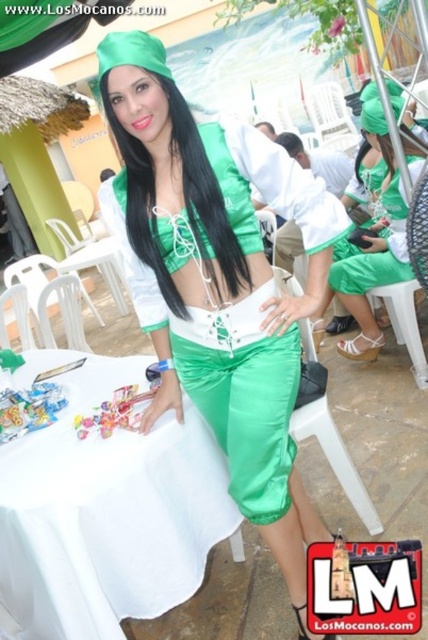
Question: Can you confirm if green satin pants at center is bigger than black silky hair at upper center?

Choices:
 (A) no
 (B) yes

Answer: (B)

Question: Observing the image, what is the correct spatial positioning of white satin tablecloth at lower left in reference to black silky hair at center?

Choices:
 (A) left
 (B) right

Answer: (A)

Question: Which of the following is the closest to the observer?

Choices:
 (A) shiny green pants at center
 (B) green satin pants at center
 (C) black silky hair at upper center

Answer: (A)

Question: Among these points, which one is nearest to the camera?

Choices:
 (A) (98, 68)
 (B) (264, 317)

Answer: (A)

Question: Which point appears closest to the camera in this image?

Choices:
 (A) click(333, 262)
 (B) click(267, 125)

Answer: (A)

Question: Observing the image, what is the correct spatial positioning of white satin tablecloth at lower left in reference to black silky hair at center?

Choices:
 (A) right
 (B) left

Answer: (B)